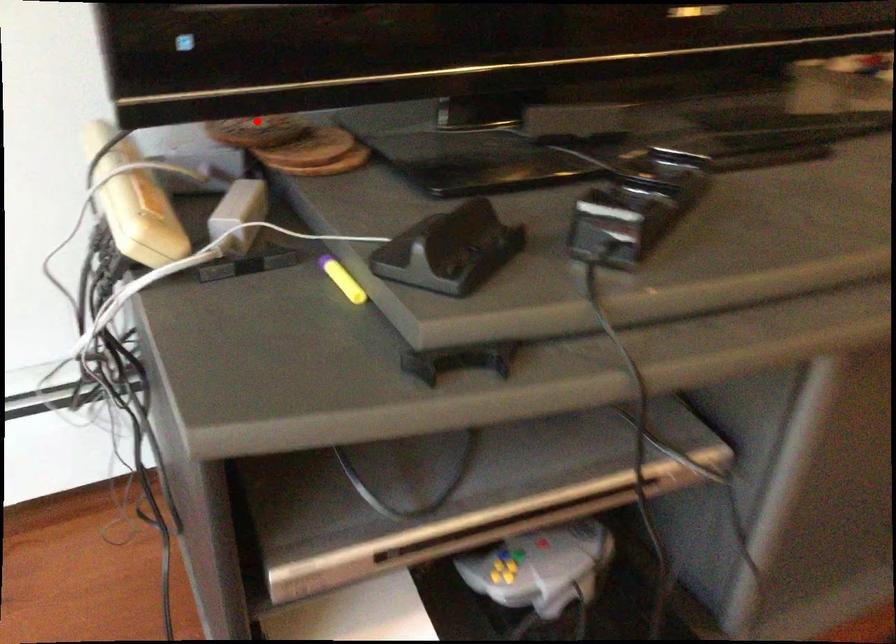
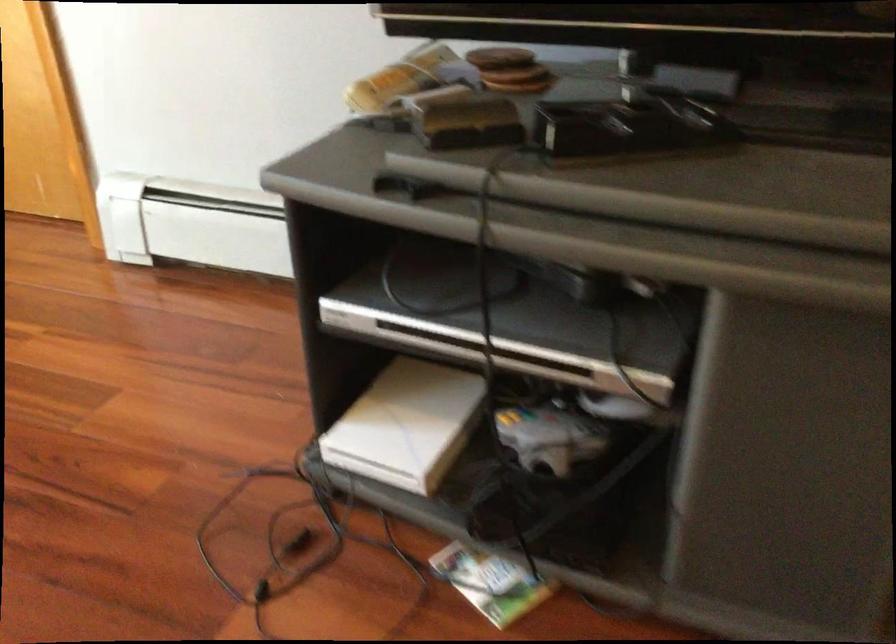
Question: I am providing you with two images of the same scene from different viewpoints. A red point is shown in image1. For the corresponding object point in image2, is it positioned nearer or farther from the camera?

Choices:
 (A) Nearer
 (B) Farther

Answer: (B)